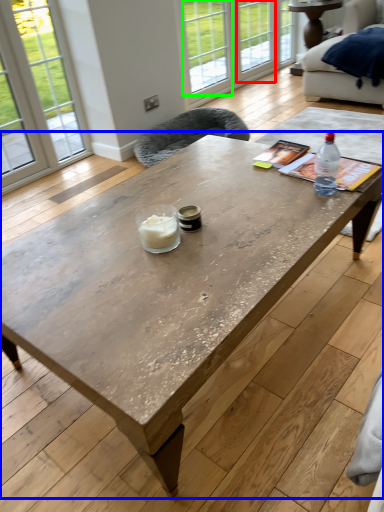
Question: Which object is the farthest from window (highlighted by a red box)? Choose among these: coffee table (highlighted by a blue box) or window (highlighted by a green box).

Choices:
 (A) coffee table
 (B) window

Answer: (A)